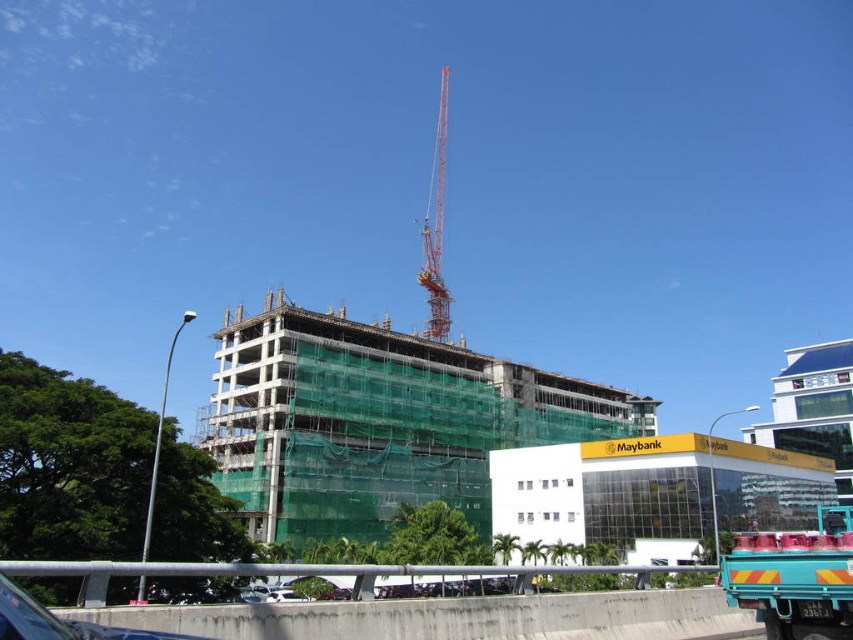
Question: Which point is closer to the camera?

Choices:
 (A) (437, 172)
 (B) (838, 540)

Answer: (B)

Question: From the image, what is the correct spatial relationship of teal matte truck at lower right in relation to orange metallic crane at upper center?

Choices:
 (A) below
 (B) above

Answer: (A)

Question: Can you confirm if teal matte truck at lower right is smaller than orange metallic crane at upper center?

Choices:
 (A) yes
 (B) no

Answer: (A)

Question: Observing the image, what is the correct spatial positioning of teal matte truck at lower right in reference to orange metallic crane at upper center?

Choices:
 (A) right
 (B) left

Answer: (A)

Question: Which of the following is the farthest from the observer?

Choices:
 (A) (422, 336)
 (B) (741, 580)

Answer: (A)